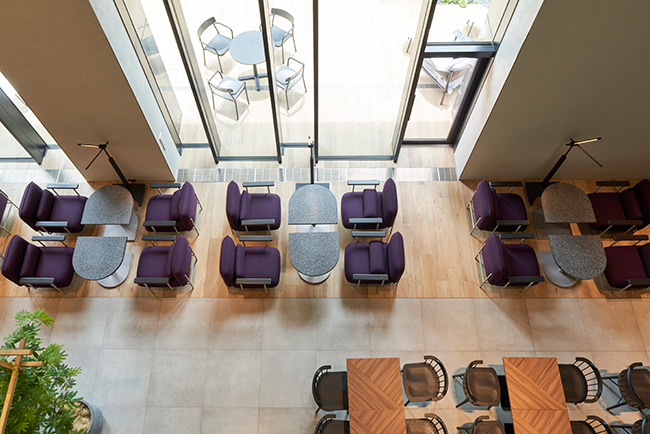
Where is `windowpanes`? This screenshot has width=650, height=434. windowpanes is located at coordinates (3, 151), (34, 125), (169, 93), (231, 12), (300, 13), (353, 35), (450, 26).